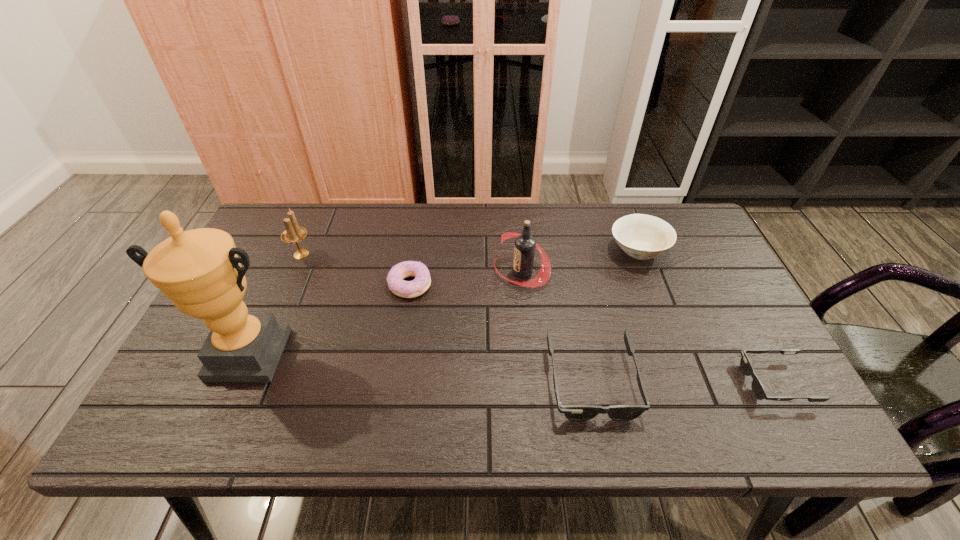
The width and height of the screenshot is (960, 540). Identify the location of empty space that is in between the candle holder and the tallest object. tap(275, 304).

You are a GUI agent. You are given a task and a screenshot of the screen. Output one action in this format:
    pyautogui.click(x=<x>, y=<y>)
    Task: Click on the free point between the candle holder and the right sunglasses
    The width and height of the screenshot is (960, 540).
    Given the screenshot: What is the action you would take?
    pyautogui.click(x=539, y=318)

The image size is (960, 540). I want to click on free space between the fourth tallest object and the candle holder, so click(x=469, y=252).

This screenshot has width=960, height=540. I want to click on blank region between the fifth tallest object and the bowl, so click(x=614, y=315).

Point out which object is positioned as the nearest to the doughnut. Please provide its 2D coordinates. Your answer should be formatted as a tuple, i.e. [(x, y)], where the tuple contains the x and y coordinates of a point satisfying the conditions above.

[(524, 250)]

Where is `the fourth closest object to the award`? the fourth closest object to the award is located at coordinates (572, 412).

I want to click on free space that satisfies the following two spatial constraints: 1. on the label of the root beer; 2. at the front of the tallest object with handles, so click(x=530, y=354).

The image size is (960, 540). What are the coordinates of `free space in the image that satisfies the following two spatial constraints: 1. on the label of the root beer; 2. at the front of the tallest object with handles` in the screenshot? It's located at (530, 354).